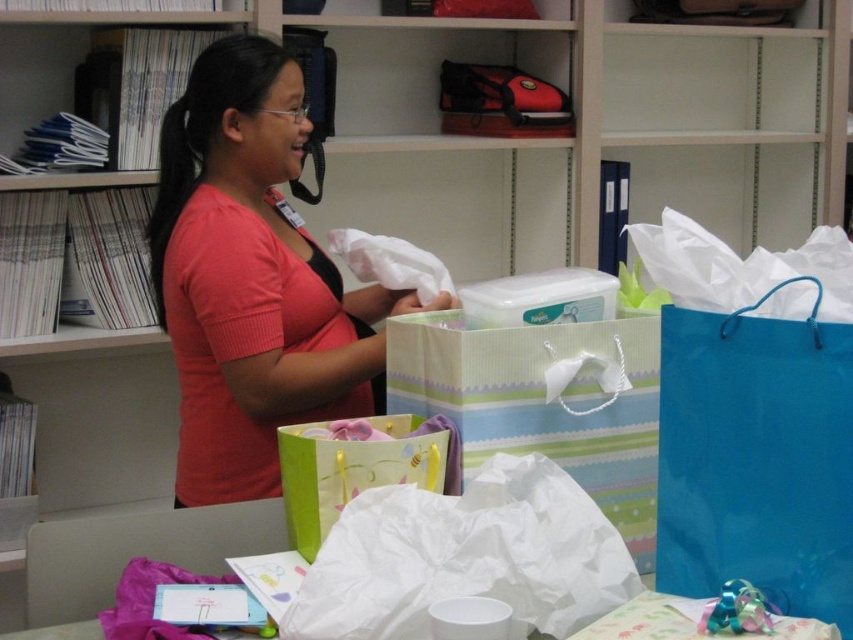
Question: Estimate the real-world distances between objects in this image. Which object is closer to the blue glossy shopping bag at center right?

Choices:
 (A) matte black bag at upper center
 (B) pink matte shirt at center

Answer: (B)

Question: Is blue glossy shopping bag at center right thinner than matte black bag at upper center?

Choices:
 (A) yes
 (B) no

Answer: (A)

Question: Which is farther from the matte green paper bag at center?

Choices:
 (A) matte black bag at upper center
 (B) pink matte shirt at center
 (C) blue glossy shopping bag at center right

Answer: (A)

Question: Does pink matte shirt at center appear over blue glossy shopping bag at center right?

Choices:
 (A) yes
 (B) no

Answer: (A)

Question: Is pink matte shirt at center above matte black bag at upper center?

Choices:
 (A) no
 (B) yes

Answer: (A)

Question: Among these objects, which one is nearest to the camera?

Choices:
 (A) matte black bag at upper center
 (B) pink matte shirt at center
 (C) matte green paper bag at center

Answer: (C)